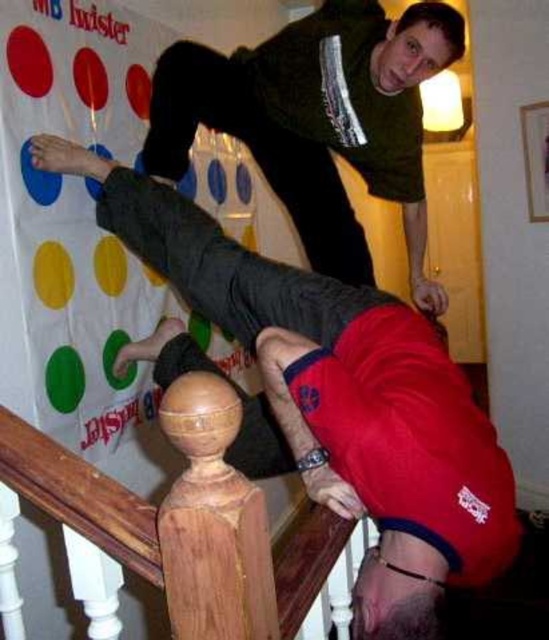
Which is in front, point (298, 168) or point (204, 618)?

Positioned in front is point (204, 618).

Find the location of a particular element. The image size is (549, 640). matte green sweater at upper center is located at coordinates (318, 120).

I want to click on matte green sweater at upper center, so click(318, 120).

Who is positioned more to the right, matte black pants at lower center or wooden at upper center?

wooden at upper center

Is matte black pants at lower center below wooden at upper center?

No.

This screenshot has width=549, height=640. Identify the location of matte black pants at lower center. (337, 397).

Can you confirm if matte black pants at lower center is wider than matte green sweater at upper center?

Indeed, matte black pants at lower center has a greater width compared to matte green sweater at upper center.

Which is more to the left, matte black pants at lower center or matte green sweater at upper center?

Positioned to the left is matte black pants at lower center.

Find the location of a particular element. matte black pants at lower center is located at coordinates (337, 397).